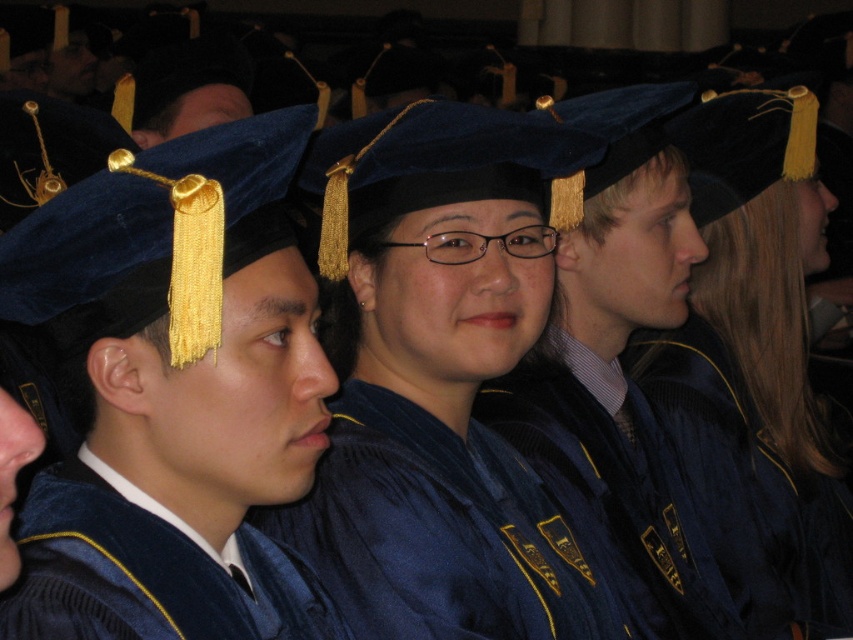
Can you confirm if velvet blue graduation cap at center is bigger than velvet blue gown at center?

Indeed, velvet blue graduation cap at center has a larger size compared to velvet blue gown at center.

Is velvet blue graduation cap at center positioned at the back of velvet blue gown at center?

Yes, velvet blue graduation cap at center is further from the viewer.

Who is more forward, (225, 529) or (86, 531)?

Positioned in front is point (86, 531).

Where is `velvet blue graduation cap at center`? This screenshot has height=640, width=853. velvet blue graduation cap at center is located at coordinates (175, 394).

Can you confirm if satin blue gown at center is shorter than velvet blue gown at center?

No, satin blue gown at center is not shorter than velvet blue gown at center.

Does satin blue gown at center appear on the left side of velvet blue gown at center?

No, satin blue gown at center is not to the left of velvet blue gown at center.

Where is `satin blue gown at center`? The image size is (853, 640). satin blue gown at center is located at coordinates (440, 532).

Can you confirm if blue velvet graduation gown at center is positioned to the left of velvet blue gown at center?

Incorrect, blue velvet graduation gown at center is not on the left side of velvet blue gown at center.

Between blue velvet graduation gown at center and velvet blue gown at center, which one appears on the left side from the viewer's perspective?

velvet blue gown at center is more to the left.

What are the coordinates of `blue velvet graduation gown at center` in the screenshot? It's located at (437, 380).

You are a GUI agent. You are given a task and a screenshot of the screen. Output one action in this format:
    pyautogui.click(x=<x>, y=<y>)
    Task: Click on the blue velvet graduation gown at center
    Image resolution: width=853 pixels, height=640 pixels.
    Given the screenshot: What is the action you would take?
    pyautogui.click(x=437, y=380)